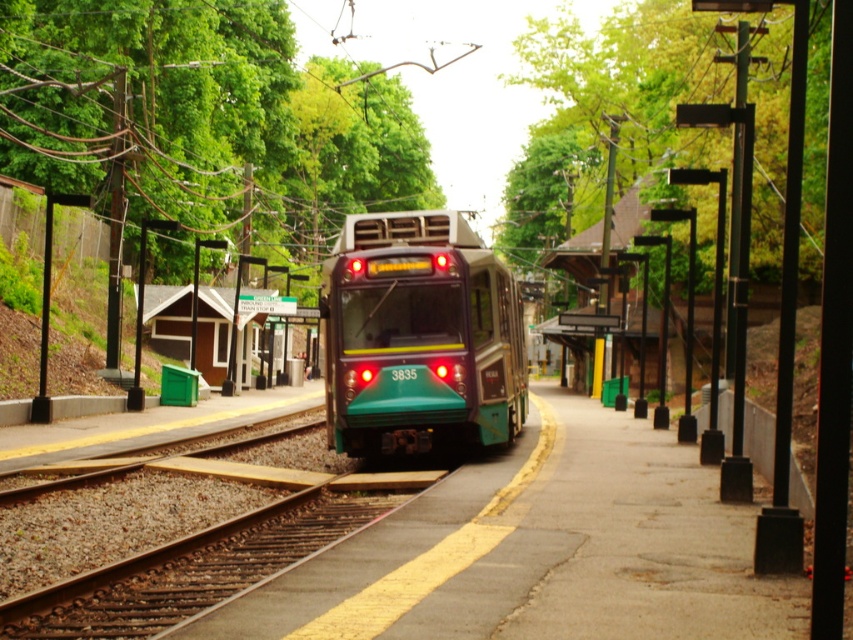
Looking at this image, you are a passenger waiting at the train station. You notice the green matte train at center and the green metallic track at center. Which object takes up more space in the image?

The green matte train at center has a larger size compared to the green metallic track at center, so it takes up more space in the image.

You are a passenger waiting at the train station. You see the green matte train at center and the green metallic track at center. Which object is closer to you?

The green matte train at center is closer to you than the green metallic track at center.